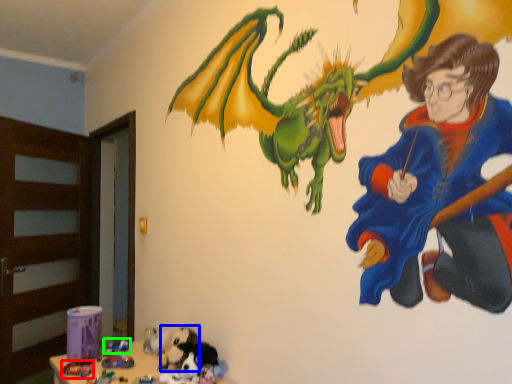
Question: Considering the real-world distances, which object is farthest from toy (highlighted by a red box)? animal (highlighted by a blue box) or toy (highlighted by a green box)?

Choices:
 (A) animal
 (B) toy

Answer: (A)